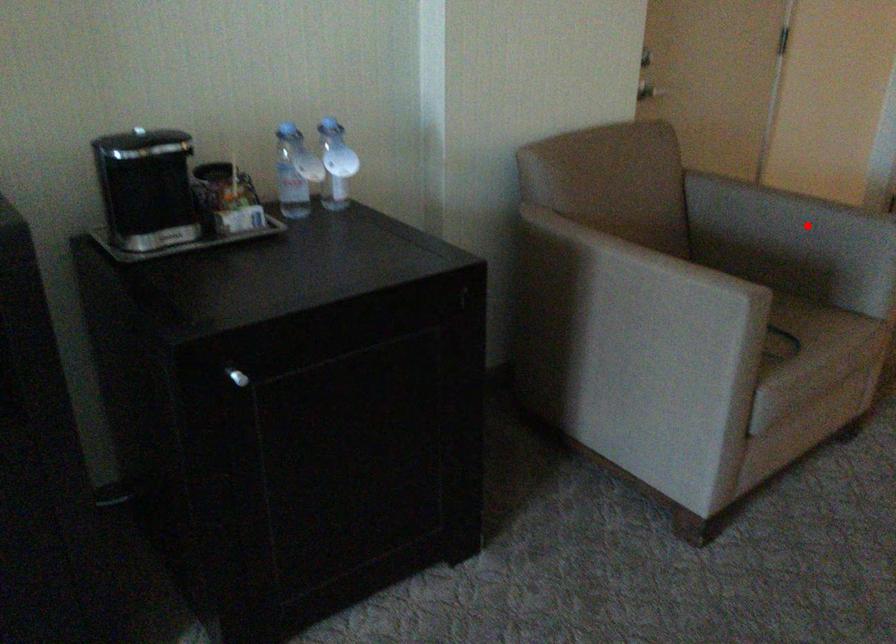
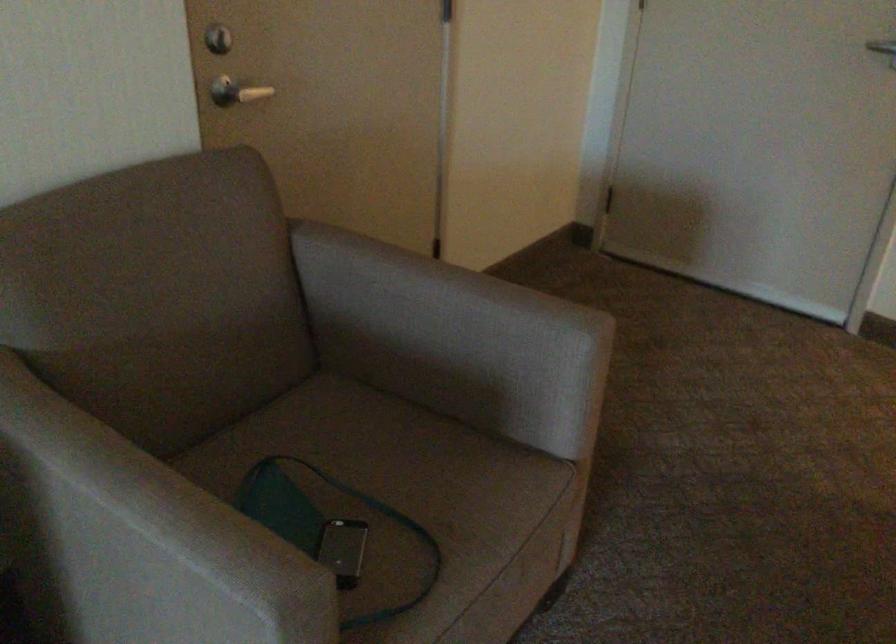
Question: I am providing you with two images of the same scene from different viewpoints. In image1, a red point is highlighted. Considering the same 3D point in image2, which of the following is correct?

Choices:
 (A) It is closer
 (B) It is farther

Answer: (A)